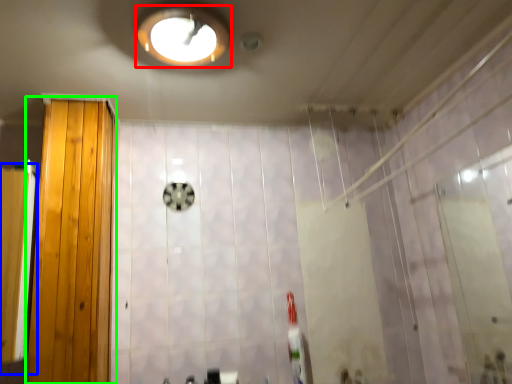
Question: Based on their relative distances, which object is farther from light fixture (highlighted by a red box)? Choose from screen door (highlighted by a blue box) and door (highlighted by a green box).

Choices:
 (A) screen door
 (B) door

Answer: (A)